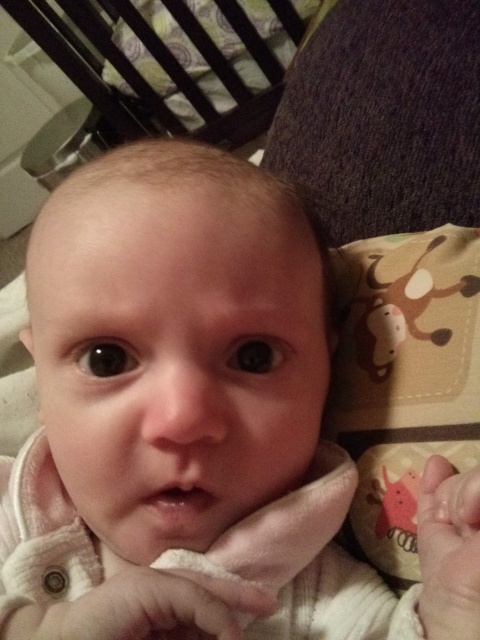
Does soft beige fabric hand at center have a smaller size compared to pink soft hand at lower right?

Incorrect, soft beige fabric hand at center is not smaller in size than pink soft hand at lower right.

Who is more forward, [196,579] or [450,467]?

Positioned in front is point [196,579].

Which is behind, point (142, 584) or point (478, 620)?

Point (142, 584)

Where is `soft beige fabric hand at center`? The height and width of the screenshot is (640, 480). soft beige fabric hand at center is located at coordinates (156, 605).

Which is more to the right, dark wood crib at upper left or pink soft hand at lower right?

pink soft hand at lower right is more to the right.

Is point (232, 93) closer to camera compared to point (475, 524)?

No, (232, 93) is further to viewer.

I want to click on dark wood crib at upper left, so click(x=213, y=67).

Image resolution: width=480 pixels, height=640 pixels. What do you see at coordinates (213, 67) in the screenshot?
I see `dark wood crib at upper left` at bounding box center [213, 67].

Who is lower down, dark wood crib at upper left or soft beige fabric hand at center?

soft beige fabric hand at center is below.

Image resolution: width=480 pixels, height=640 pixels. What do you see at coordinates (213, 67) in the screenshot? I see `dark wood crib at upper left` at bounding box center [213, 67].

I want to click on dark wood crib at upper left, so click(x=213, y=67).